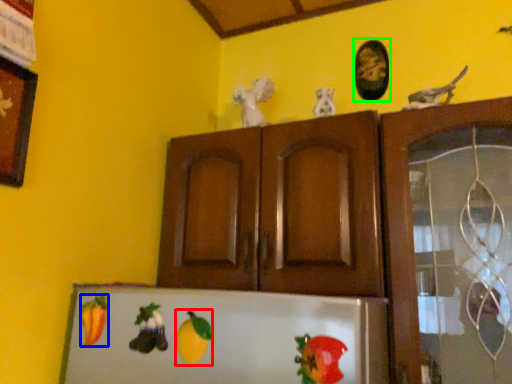
Question: Which object is the farthest from fruit (highlighted by a red box)? Choose among these: fruit (highlighted by a blue box) or picture frame (highlighted by a green box).

Choices:
 (A) fruit
 (B) picture frame

Answer: (B)